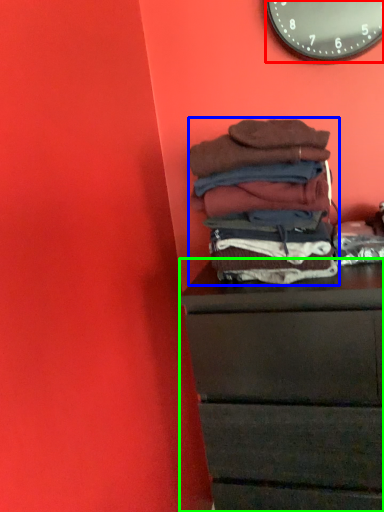
Question: Which is nearer to the wall clock (highlighted by a red box)? material (highlighted by a blue box) or chest of drawers (highlighted by a green box).

Choices:
 (A) material
 (B) chest of drawers

Answer: (A)